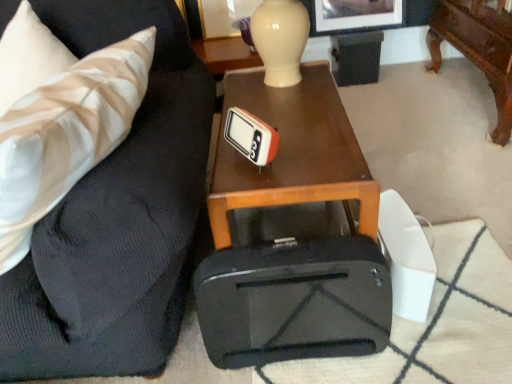
In order to click on empty space that is ontop of woodenobject at center in this screenshot , I will do `click(292, 126)`.